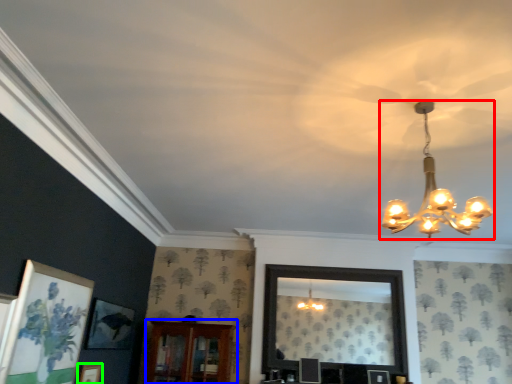
Question: Which object is positioned farthest from lamp (highlighted by a red box)? Select from furniture (highlighted by a blue box) and picture frame (highlighted by a green box).

Choices:
 (A) furniture
 (B) picture frame

Answer: (B)